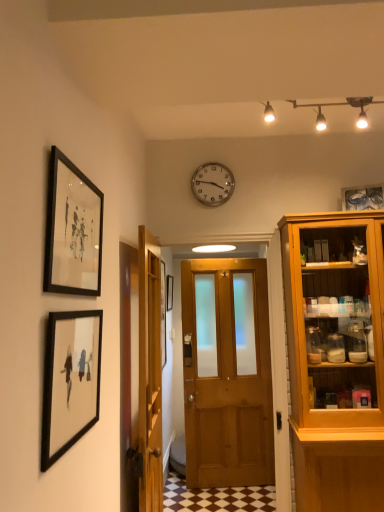
Question: From the image's perspective, is wooden door at center, the 2th door positioned from the left, below white glossy track lights at upper center?

Choices:
 (A) yes
 (B) no

Answer: (A)

Question: Does wooden door at center, the 2th door positioned from the left, come behind white glossy track lights at upper center?

Choices:
 (A) no
 (B) yes

Answer: (B)

Question: Would you consider wooden door at center, the 1th door positioned from the right, to be distant from white glossy track lights at upper center?

Choices:
 (A) no
 (B) yes

Answer: (B)

Question: Does wooden door at center, the 1th door positioned from the right, appear on the left side of white glossy track lights at upper center?

Choices:
 (A) yes
 (B) no

Answer: (A)

Question: Does wooden door at center, the 1th door positioned from the right, have a larger size compared to white glossy track lights at upper center?

Choices:
 (A) no
 (B) yes

Answer: (B)

Question: Can you confirm if wooden door at center, the 1th door positioned from the right, is taller than white glossy track lights at upper center?

Choices:
 (A) no
 (B) yes

Answer: (B)

Question: Can you confirm if black matte picture frame at upper left, the second picture frame from the front, is positioned to the left of black matte picture frame at center, which is the 1th picture frame in back-to-front order?

Choices:
 (A) yes
 (B) no

Answer: (A)

Question: Considering the relative sizes of black matte picture frame at upper left, marked as the 2th picture frame in a left-to-right arrangement, and black matte picture frame at center, the 4th picture frame when ordered from front to back, in the image provided, is black matte picture frame at upper left, marked as the 2th picture frame in a left-to-right arrangement, bigger than black matte picture frame at center, the 4th picture frame when ordered from front to back,?

Choices:
 (A) yes
 (B) no

Answer: (A)

Question: From a real-world perspective, is black matte picture frame at upper left, positioned as the 3th picture frame in right-to-left order, under black matte picture frame at center, marked as the 2th picture frame in a right-to-left arrangement?

Choices:
 (A) yes
 (B) no

Answer: (B)

Question: Is black matte picture frame at upper left, the second picture frame from the front, oriented towards black matte picture frame at center, marked as the 2th picture frame in a right-to-left arrangement?

Choices:
 (A) no
 (B) yes

Answer: (A)

Question: From the image's perspective, is black matte picture frame at upper left, positioned as the 3th picture frame in right-to-left order, over black matte picture frame at center, which is the 1th picture frame in back-to-front order?

Choices:
 (A) yes
 (B) no

Answer: (A)

Question: From a real-world perspective, is black matte picture frame at upper left, which ranks as the 3th picture frame in back-to-front order, positioned over black matte picture frame at center, marked as the 2th picture frame in a right-to-left arrangement, based on gravity?

Choices:
 (A) yes
 (B) no

Answer: (A)

Question: Is black matte picture frame at lower left, arranged as the first picture frame when viewed from the front, at the back of silver metallic clock at upper center?

Choices:
 (A) no
 (B) yes

Answer: (A)